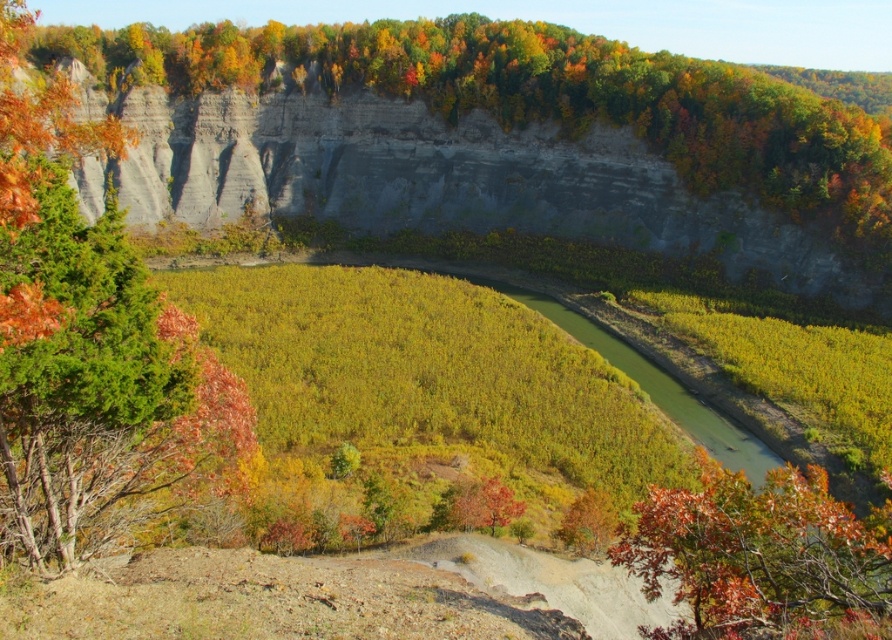
Question: Which point is farther to the camera?

Choices:
 (A) green leafy tree at left
 (B) smooth gray cliff face at upper center
 (C) autumn leaves at lower right

Answer: (B)

Question: Which of the following is the farthest from the observer?

Choices:
 (A) autumn leaves at lower right
 (B) green leafy tree at left
 (C) smooth gray cliff face at upper center

Answer: (C)

Question: Can you confirm if smooth gray cliff face at upper center is wider than autumn leaves at lower right?

Choices:
 (A) no
 (B) yes

Answer: (B)

Question: Can you confirm if smooth gray cliff face at upper center is wider than autumn leaves at lower right?

Choices:
 (A) yes
 (B) no

Answer: (A)

Question: Does green leafy tree at left have a larger size compared to autumn leaves at lower right?

Choices:
 (A) yes
 (B) no

Answer: (A)

Question: Based on their relative distances, which object is farther from the green leafy tree at left?

Choices:
 (A) autumn leaves at lower right
 (B) smooth gray cliff face at upper center

Answer: (B)